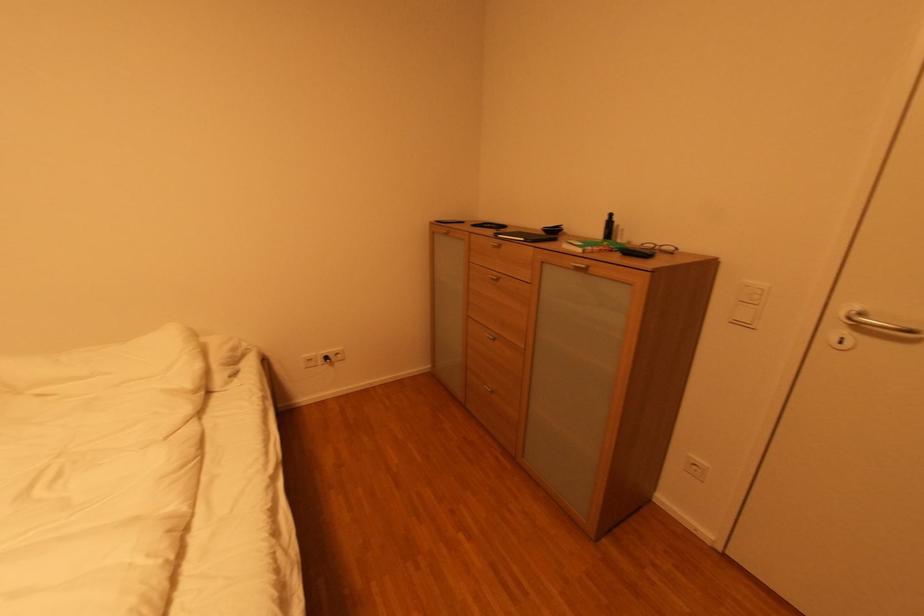
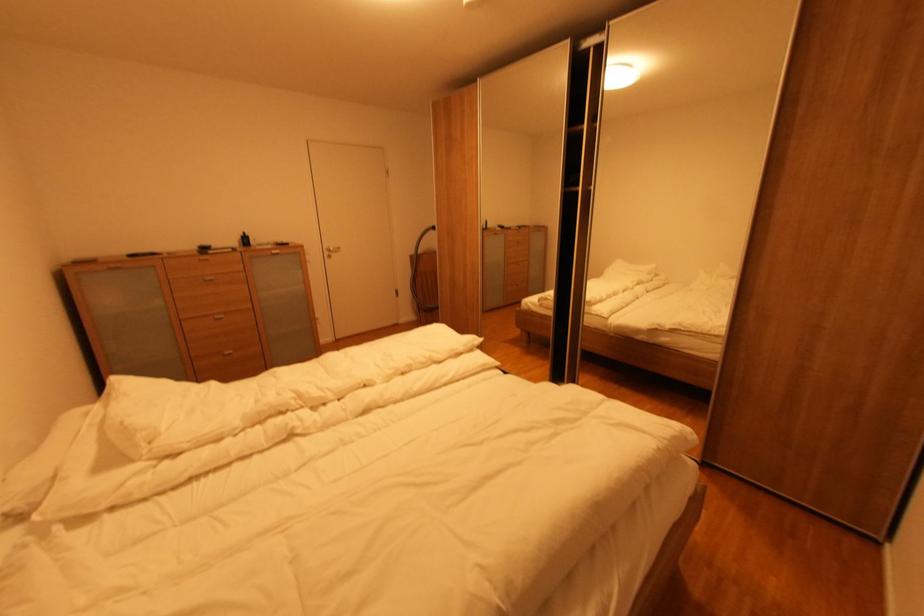
The point at (613, 219) is marked in the first image. Where is the corresponding point in the second image?

(248, 237)